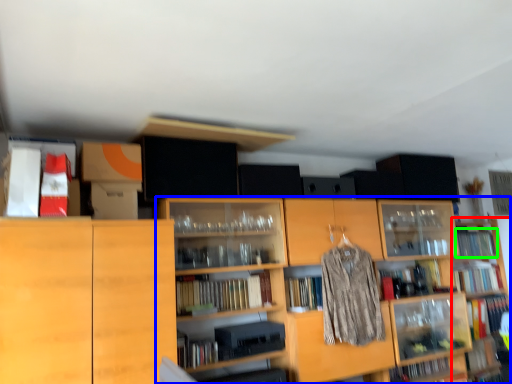
Question: Estimate the real-world distances between objects in this image. Which object is closer to shelf (highlighted by a red box), shelf (highlighted by a blue box) or book (highlighted by a green box)?

Choices:
 (A) shelf
 (B) book

Answer: (B)